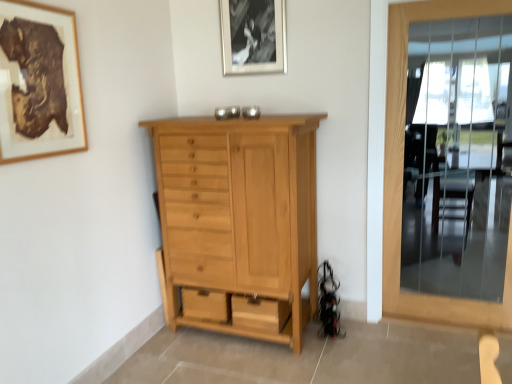
Question: Is wooden picture frame at upper left, placed as the 2th picture frame when sorted from top to bottom, closer to the viewer compared to clear glass door at right?

Choices:
 (A) yes
 (B) no

Answer: (A)

Question: Is wooden picture frame at upper left, the 1th picture frame in the front-to-back sequence, to the right of clear glass door at right from the viewer's perspective?

Choices:
 (A) yes
 (B) no

Answer: (B)

Question: Is wooden picture frame at upper left, which ranks as the first picture frame in left-to-right order, to the left of clear glass door at right from the viewer's perspective?

Choices:
 (A) no
 (B) yes

Answer: (B)

Question: Does wooden picture frame at upper left, arranged as the second picture frame when viewed from the right, lie behind clear glass door at right?

Choices:
 (A) no
 (B) yes

Answer: (A)

Question: Is clear glass door at right located within wooden picture frame at upper left, arranged as the second picture frame when viewed from the right?

Choices:
 (A) no
 (B) yes

Answer: (A)

Question: In the image, is black matte picture frame at upper center, positioned as the 2th picture frame in front-to-back order, positioned in front of or behind natural wood cabinet at center?

Choices:
 (A) behind
 (B) front

Answer: (A)

Question: In terms of height, does black matte picture frame at upper center, which is the second picture frame in bottom-to-top order, look taller or shorter compared to natural wood cabinet at center?

Choices:
 (A) short
 (B) tall

Answer: (A)

Question: From a real-world perspective, is black matte picture frame at upper center, marked as the first picture frame in a back-to-front arrangement, positioned above or below natural wood cabinet at center?

Choices:
 (A) below
 (B) above

Answer: (B)

Question: Considering the positions of black matte picture frame at upper center, which is counted as the 2th picture frame, starting from the left, and natural wood cabinet at center in the image, is black matte picture frame at upper center, which is counted as the 2th picture frame, starting from the left, bigger or smaller than natural wood cabinet at center?

Choices:
 (A) small
 (B) big

Answer: (A)

Question: From the image's perspective, is wooden picture frame at upper left, placed as the 2th picture frame when sorted from top to bottom, positioned above or below clear glass door at right?

Choices:
 (A) below
 (B) above

Answer: (B)

Question: From a real-world perspective, is wooden picture frame at upper left, the 1th picture frame from the bottom, positioned above or below clear glass door at right?

Choices:
 (A) above
 (B) below

Answer: (A)

Question: Considering the positions of wooden picture frame at upper left, which ranks as the first picture frame in left-to-right order, and clear glass door at right in the image, is wooden picture frame at upper left, which ranks as the first picture frame in left-to-right order, taller or shorter than clear glass door at right?

Choices:
 (A) tall
 (B) short

Answer: (B)

Question: Is wooden picture frame at upper left, which ranks as the first picture frame in left-to-right order, wider or thinner than clear glass door at right?

Choices:
 (A) thin
 (B) wide

Answer: (A)

Question: Based on their positions, is natural wood cabinet at center located to the left or right of wooden picture frame at upper left, the 1th picture frame from the bottom?

Choices:
 (A) left
 (B) right

Answer: (B)

Question: From a real-world perspective, is natural wood cabinet at center above or below wooden picture frame at upper left, placed as the 2th picture frame when sorted from top to bottom?

Choices:
 (A) below
 (B) above

Answer: (A)